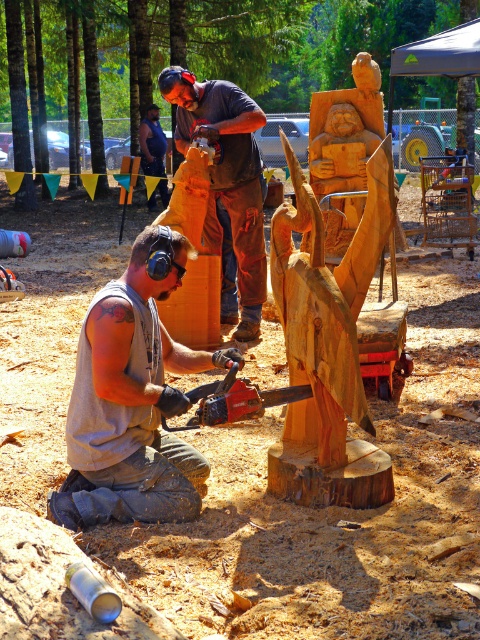
You are a photographer at the event and need to capture a clear photo of both the gray fabric sleeveless shirt at lower left and the dark blue shirt at upper center. Which shirt should you focus on first to ensure both are in focus?

The gray fabric sleeveless shirt at lower left is positioned under the dark blue shirt at upper center, so you should focus on the dark blue shirt at upper center first to ensure both are in focus.

Based on the scene description, can you determine the spatial relationship between the wooden statue at center and the wooden chainsaw at center?

The wooden statue at center is above the wooden chainsaw at center.

You are a photographer at the event and want to capture both the gray fabric sleeveless shirt at lower left and the dark blue shirt at upper center in a single frame. Based on their positions, which shirt might require you to adjust your camera angle more to ensure both are fully visible?

The gray fabric sleeveless shirt at lower left might require adjusting the camera angle more since it could be wider than the dark blue shirt at upper center, making it harder to frame both without cropping.